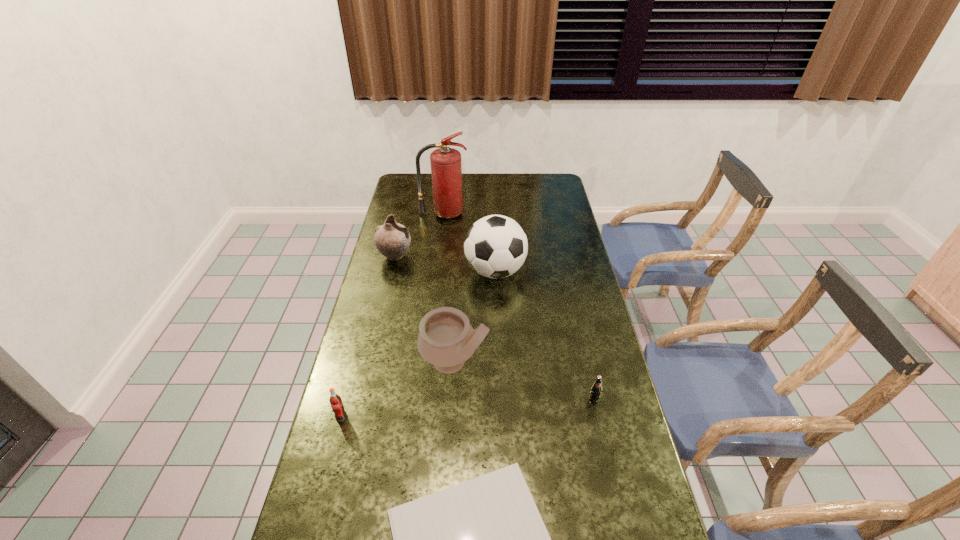
Where is `free area in between the left pottery and the fire extinguisher`? The height and width of the screenshot is (540, 960). free area in between the left pottery and the fire extinguisher is located at coordinates (420, 235).

Where is `object that stands as the third closest to the farthest object`? The height and width of the screenshot is (540, 960). object that stands as the third closest to the farthest object is located at coordinates (446, 339).

I want to click on object that is the sixth closest to the soccer ball, so click(484, 539).

The height and width of the screenshot is (540, 960). Identify the location of vacant space that satisfies the following two spatial constraints: 1. from the spout of the farther pottery; 2. on the back side of the soccer ball. (392, 271).

Image resolution: width=960 pixels, height=540 pixels. I want to click on vacant space that satisfies the following two spatial constraints: 1. on the back side of the soccer ball; 2. from the spout of the farther pottery, so click(494, 256).

Where is `free spot that satisfies the following two spatial constraints: 1. at the front of the farthest object where the nozzle is aimed; 2. on the left side of the nearer pottery`? Image resolution: width=960 pixels, height=540 pixels. free spot that satisfies the following two spatial constraints: 1. at the front of the farthest object where the nozzle is aimed; 2. on the left side of the nearer pottery is located at coordinates (426, 362).